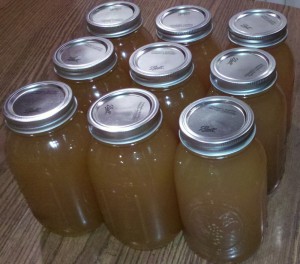
Where is `rightmost row of jars`? rightmost row of jars is located at coordinates (231, 186), (274, 102), (283, 61).